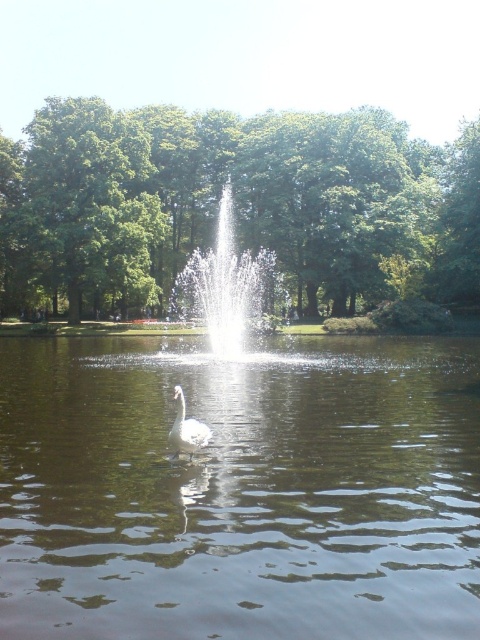
Looking at this image, between clear water at center and green leafy tree at upper left, which one is positioned higher?

green leafy tree at upper left is higher up.

Does point (410, 540) come closer to viewer compared to point (96, 276)?

Yes, point (410, 540) is closer to viewer.

Find the location of `clear water at center`. clear water at center is located at coordinates (240, 490).

Can you confirm if clear water at center is shorter than green leafy tree at center?

Correct, clear water at center is not as tall as green leafy tree at center.

Does clear water at center have a larger size compared to green leafy tree at center?

No, clear water at center is not bigger than green leafy tree at center.

Measure the distance between clear water at center and camera.

They are 12.26 feet apart.

Where is `clear water at center`? clear water at center is located at coordinates (240, 490).

Between point (235, 189) and point (146, 179), which one is positioned in front?

Point (146, 179)

Can you confirm if green leafy tree at center is wider than green leafy tree at upper left?

Yes, green leafy tree at center is wider than green leafy tree at upper left.

Describe the element at coordinates (235, 204) in the screenshot. The height and width of the screenshot is (640, 480). I see `green leafy tree at center` at that location.

I want to click on green leafy tree at center, so click(x=235, y=204).